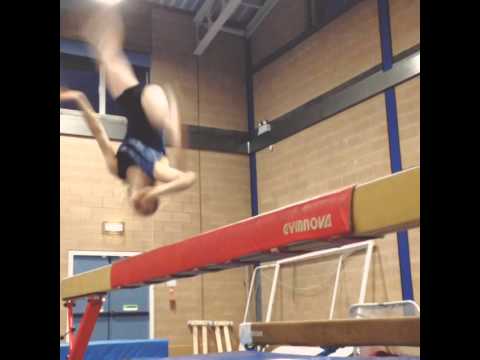
You are a GUI agent. You are given a task and a screenshot of the screen. Output one action in this format:
    pyautogui.click(x=<x>, y=<y>)
    Task: Click on the brick wall
    The width and height of the screenshot is (480, 360).
    Given the screenshot: What is the action you would take?
    pyautogui.click(x=312, y=172)